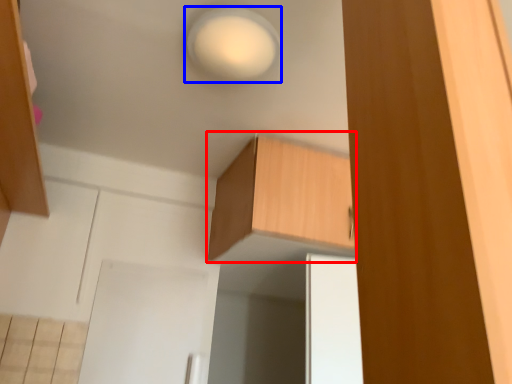
Question: Which point is closer to the camera, cabinetry (highlighted by a red box) or light (highlighted by a blue box)?

Choices:
 (A) cabinetry
 (B) light

Answer: (B)